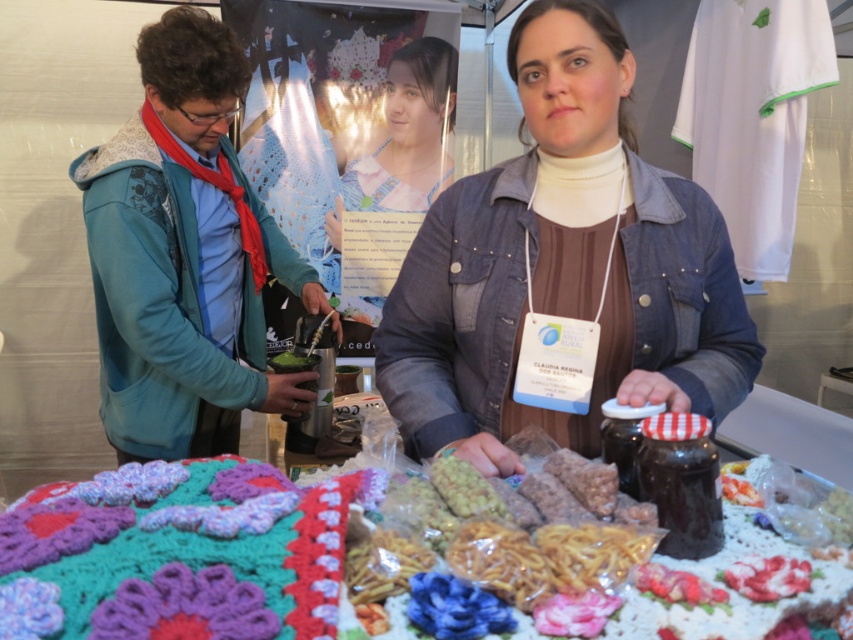
Which is below, light blue fabric dress at center or knitted fabric at lower left?

knitted fabric at lower left is below.

Can you confirm if light blue fabric dress at center is taller than knitted fabric at lower left?

Yes.

I want to click on light blue fabric dress at center, so click(x=399, y=141).

Is denim jacket at center smaller than knitted fabric at lower left?

Incorrect, denim jacket at center is not smaller in size than knitted fabric at lower left.

Locate an element on the screen. This screenshot has width=853, height=640. denim jacket at center is located at coordinates (563, 266).

Where is `denim jacket at center`? This screenshot has height=640, width=853. denim jacket at center is located at coordinates (563, 266).

Between blue fleece jacket at left and light blue fabric dress at center, which one is positioned lower?

Positioned lower is blue fleece jacket at left.

Between point (148, 314) and point (428, 58), which one is positioned behind?

The point (428, 58) is behind.

Locate an element on the screen. This screenshot has width=853, height=640. blue fleece jacket at left is located at coordinates (184, 257).